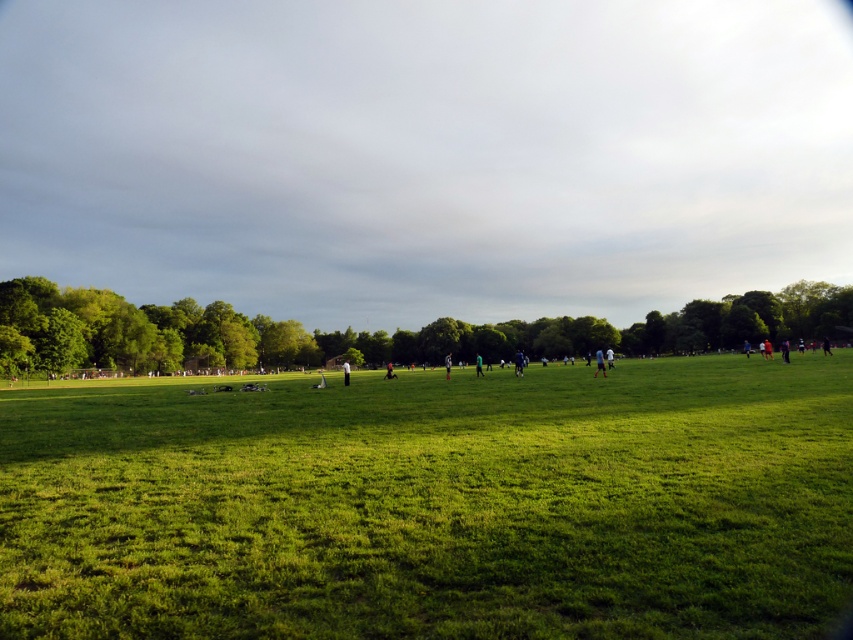
Question: Which object is the farthest from the dark blue shirt at right?

Choices:
 (A) white cotton shirt at center
 (B) dark blue jersey at center-right
 (C) blue fabric person at center
 (D) green fabric person at center

Answer: (A)

Question: Which point is farther from the camera taking this photo?

Choices:
 (A) (851, 321)
 (B) (474, 365)
 (C) (596, 372)
 (D) (341, 365)

Answer: (A)

Question: In this image, where is green leafy tree at lower left located relative to white cotton shirt at center?

Choices:
 (A) right
 (B) left

Answer: (A)

Question: Which point appears farthest from the camera in this image?

Choices:
 (A) (515, 365)
 (B) (347, 378)
 (C) (599, 352)
 (D) (445, 371)

Answer: (D)

Question: Is dark blue jersey at center-right closer to camera compared to dark blue shirt at right?

Choices:
 (A) no
 (B) yes

Answer: (B)

Question: Does cloudy sky at upper center appear over green leafy tree at lower left?

Choices:
 (A) no
 (B) yes

Answer: (B)